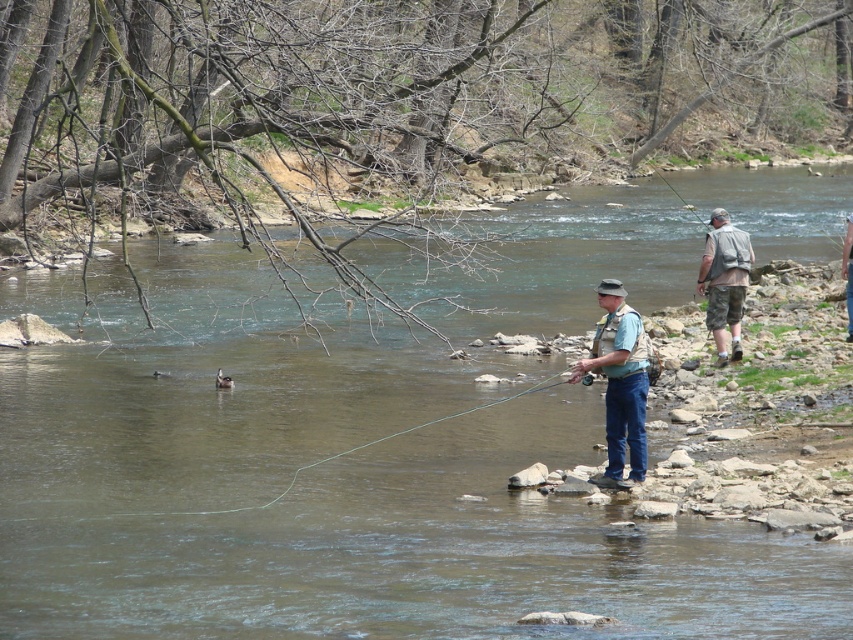
Question: Does light blue fabric shirt at center appear over gray fabric vest at right?

Choices:
 (A) no
 (B) yes

Answer: (A)

Question: Which object appears farthest from the camera in this image?

Choices:
 (A) gray fabric vest at right
 (B) clear water at river center
 (C) light blue fabric vest at center
 (D) light blue fabric shirt at center

Answer: (A)

Question: Is clear water at river center thinner than gray fabric vest at right?

Choices:
 (A) yes
 (B) no

Answer: (B)

Question: Estimate the real-world distances between objects in this image. Which object is farther from the gray fabric vest at right?

Choices:
 (A) light blue fabric shirt at center
 (B) clear water at river center

Answer: (B)

Question: Where is clear water at river center located in relation to light blue fabric vest at center in the image?

Choices:
 (A) left
 (B) right

Answer: (A)

Question: Which point is closer to the camera?

Choices:
 (A) gray fabric vest at right
 (B) clear water at river center
 (C) light blue fabric vest at center

Answer: (B)